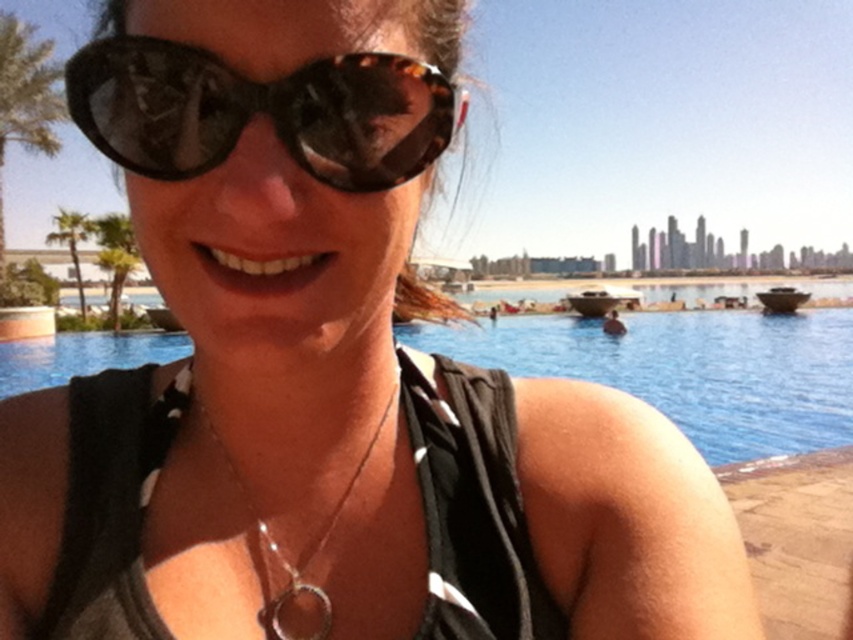
Is blue glass swimming pool at center to the right of tortoiseshell sunglasses at center from the viewer's perspective?

Yes, blue glass swimming pool at center is to the right of tortoiseshell sunglasses at center.

Can you confirm if blue glass swimming pool at center is smaller than tortoiseshell sunglasses at center?

Actually, blue glass swimming pool at center might be larger than tortoiseshell sunglasses at center.

The height and width of the screenshot is (640, 853). I want to click on blue glass swimming pool at center, so click(x=689, y=371).

The image size is (853, 640). What do you see at coordinates (689, 371) in the screenshot?
I see `blue glass swimming pool at center` at bounding box center [689, 371].

Is point (515, 323) more distant than point (277, 589)?

Yes, it is.

Where is `blue glass swimming pool at center`? The image size is (853, 640). blue glass swimming pool at center is located at coordinates (689, 371).

Does tortoiseshell sunglasses at center have a smaller size compared to silver metallic necklace at center?

Incorrect, tortoiseshell sunglasses at center is not smaller in size than silver metallic necklace at center.

Measure the distance between tortoiseshell sunglasses at center and camera.

A distance of 21.37 inches exists between tortoiseshell sunglasses at center and camera.

The width and height of the screenshot is (853, 640). What are the coordinates of `tortoiseshell sunglasses at center` in the screenshot? It's located at (260, 112).